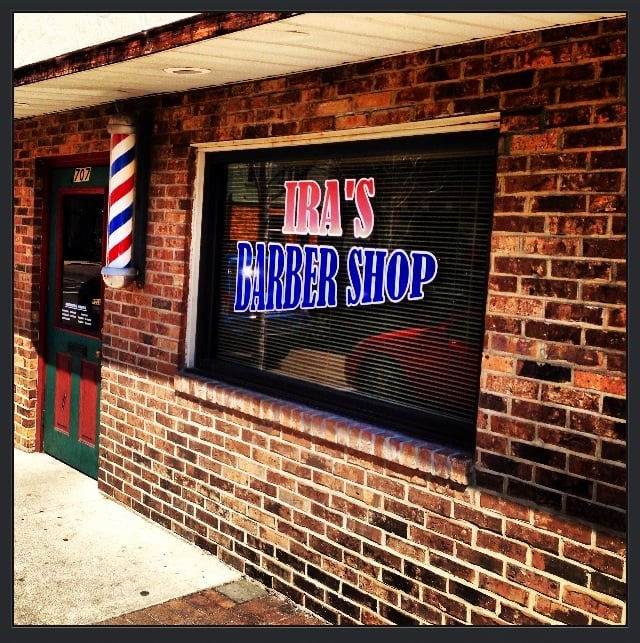
Locate an element on the screen. This screenshot has height=643, width=640. red vertical door pieces is located at coordinates (63, 388), (89, 412).